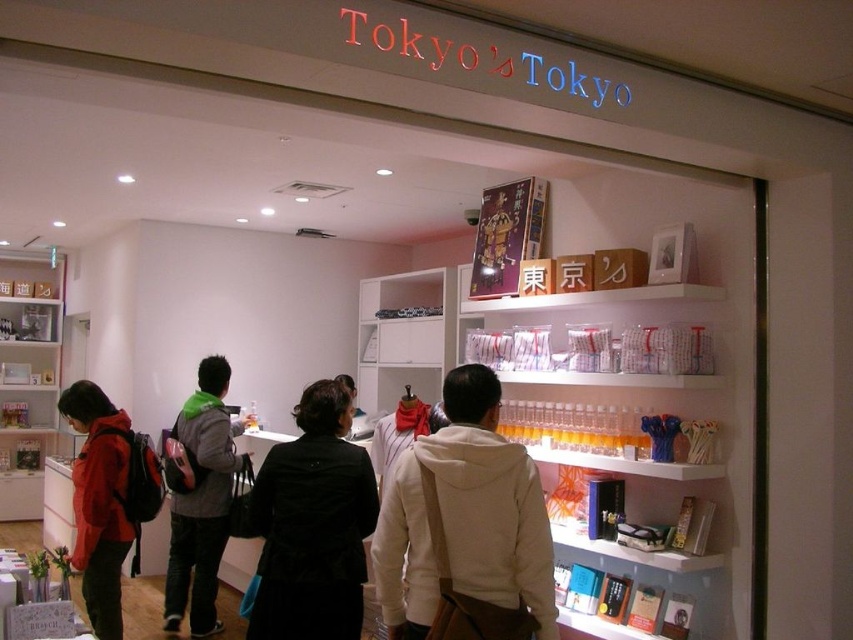
You are a customer in the store and want to place the gray backpack at center on top of the matte red jacket at left. Is this possible based on their sizes?

The gray backpack at center is taller than the matte red jacket at left, so placing the gray backpack at center on top of the matte red jacket at left may not be stable due to its greater height.

You are a customer in the store and want to buy both the white fleece jacket at center and the matte red jacket at left. If you start from the entrance, which jacket should you pick up first to follow the left to right shopping path?

You should pick up the matte red jacket at left first because it is located to the left of the white fleece jacket at center, following the left to right shopping path.